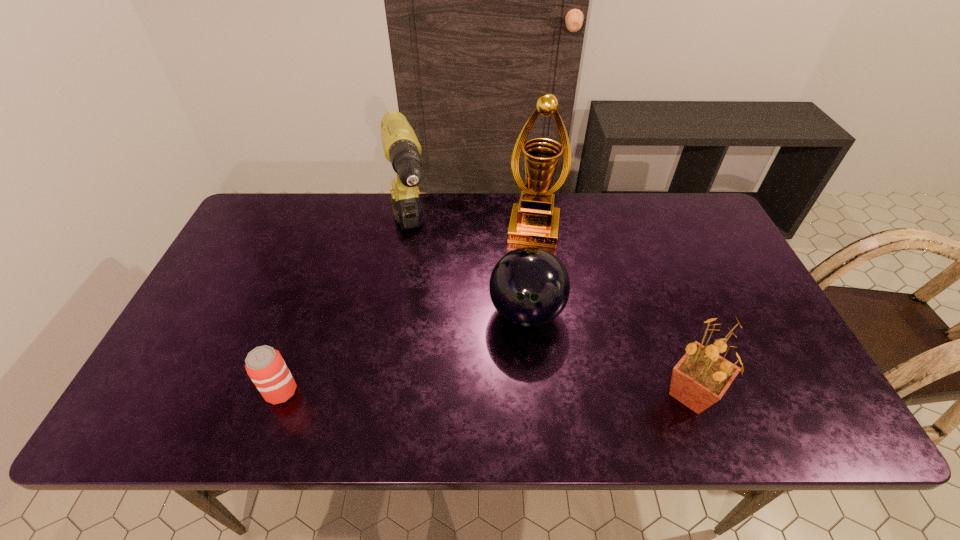
Identify the location of vacant space located at the front of the third shortest object with flowers visible. The width and height of the screenshot is (960, 540). (502, 394).

The image size is (960, 540). I want to click on vacant space located 0.090m at the front of the third shortest object with flowers visible, so click(618, 394).

The image size is (960, 540). Identify the location of free space located at the front of the third shortest object with flowers visible. (534, 394).

This screenshot has width=960, height=540. What are the coordinates of `free point located 0.140m on the handle side of the second object from left to right` in the screenshot? It's located at (421, 308).

Image resolution: width=960 pixels, height=540 pixels. Find the location of `vacant space located on the handle side of the second object from left to right`. vacant space located on the handle side of the second object from left to right is located at coordinates (426, 326).

Locate an element on the screen. The image size is (960, 540). vacant point located 0.050m on the handle side of the second object from left to right is located at coordinates (416, 284).

Locate an element on the screen. vacant space situated 0.070m on the front-facing side of the award is located at coordinates (529, 262).

Image resolution: width=960 pixels, height=540 pixels. I want to click on free space located on the front-facing side of the award, so click(525, 290).

Locate an element on the screen. free location located on the front-facing side of the award is located at coordinates (521, 313).

What are the coordinates of `vacant space located on the side of the fourth tallest object with the finger holes` in the screenshot? It's located at (531, 361).